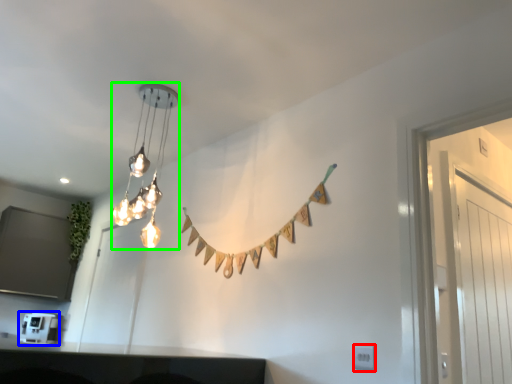
Question: Which object is positioned farthest from electric outlet (highlighted by a red box)? Select from appliance (highlighted by a blue box) and lamp (highlighted by a green box).

Choices:
 (A) appliance
 (B) lamp

Answer: (A)